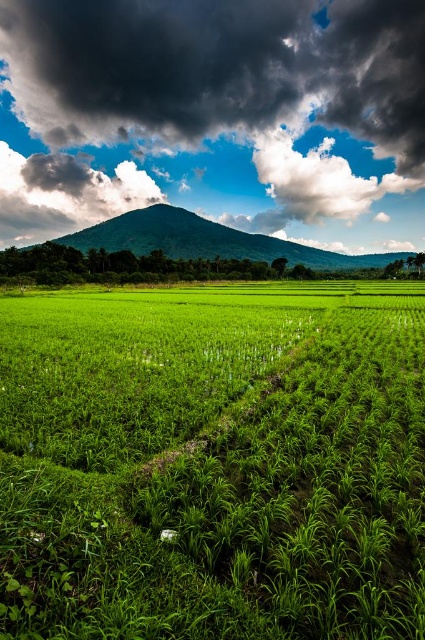
Is point (346, 609) closer to camera compared to point (71, 202)?

Yes.

Is green grassy rice field at center thinner than dark gray cloud at upper center?

Yes, green grassy rice field at center is thinner than dark gray cloud at upper center.

Is point (112, 529) less distant than point (388, 4)?

Yes, it is.

You are a GUI agent. You are given a task and a screenshot of the screen. Output one action in this format:
    pyautogui.click(x=<x>, y=<y>)
    Task: Click on the green grassy rice field at center
    
    Given the screenshot: What is the action you would take?
    pyautogui.click(x=212, y=461)

From the picture: Does dark gray cloud at upper center appear on the left side of green leafy mountain at center?

Yes, dark gray cloud at upper center is to the left of green leafy mountain at center.

Describe the element at coordinates (215, 115) in the screenshot. I see `dark gray cloud at upper center` at that location.

Locate an element on the screen. This screenshot has height=640, width=425. dark gray cloud at upper center is located at coordinates (215, 115).

Between green grassy rice field at center and green leafy mountain at center, which one appears on the left side from the viewer's perspective?

green grassy rice field at center

Does point (98, 588) lie in front of point (87, 248)?

That is True.

Between point (340, 376) and point (178, 234), which one is positioned in front?

Point (340, 376) is in front.

You are a GUI agent. You are given a task and a screenshot of the screen. Output one action in this format:
    pyautogui.click(x=<x>, y=<y>)
    Task: Click on the green grassy rice field at center
    The image size is (425, 640).
    Given the screenshot: What is the action you would take?
    pyautogui.click(x=212, y=461)